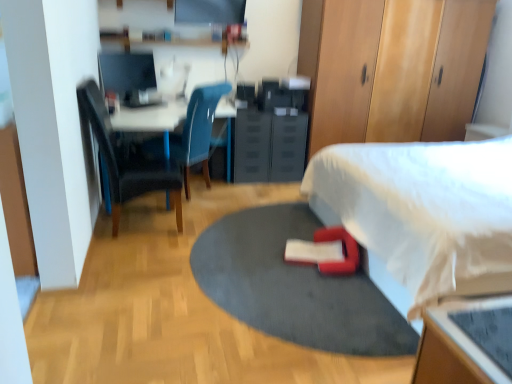
Question: Could you tell me if white glossy desk at upper left is turned towards wooden dresser at upper right, the 2th dresser viewed from the left?

Choices:
 (A) no
 (B) yes

Answer: (B)

Question: Is white glossy desk at upper left positioned far away from wooden dresser at upper right, the 2th dresser viewed from the left?

Choices:
 (A) no
 (B) yes

Answer: (B)

Question: Is white glossy desk at upper left oriented away from wooden dresser at upper right, placed as the 1th dresser when sorted from right to left?

Choices:
 (A) no
 (B) yes

Answer: (A)

Question: Considering the relative sizes of white glossy desk at upper left and wooden dresser at upper right, the 2th dresser viewed from the left, in the image provided, is white glossy desk at upper left wider than wooden dresser at upper right, the 2th dresser viewed from the left,?

Choices:
 (A) yes
 (B) no

Answer: (A)

Question: Is the depth of white glossy desk at upper left greater than that of wooden dresser at upper right, the 2th dresser viewed from the left?

Choices:
 (A) no
 (B) yes

Answer: (A)

Question: Considering the relative positions of white glossy desk at upper left and wooden dresser at upper right, placed as the 1th dresser when sorted from right to left, in the image provided, is white glossy desk at upper left to the right of wooden dresser at upper right, placed as the 1th dresser when sorted from right to left, from the viewer's perspective?

Choices:
 (A) no
 (B) yes

Answer: (A)

Question: Is white fabric bed at lower right behind wooden dresser at upper right, the 2th dresser viewed from the left?

Choices:
 (A) no
 (B) yes

Answer: (A)

Question: Is white fabric bed at lower right wider than wooden dresser at upper right, the 2th dresser viewed from the left?

Choices:
 (A) no
 (B) yes

Answer: (B)

Question: Can you confirm if white fabric bed at lower right is positioned to the left of wooden dresser at upper right, the 2th dresser viewed from the left?

Choices:
 (A) no
 (B) yes

Answer: (A)

Question: Can you confirm if white fabric bed at lower right is smaller than wooden dresser at upper right, the 2th dresser viewed from the left?

Choices:
 (A) yes
 (B) no

Answer: (B)

Question: Is white fabric bed at lower right oriented away from wooden dresser at upper right, the 2th dresser viewed from the left?

Choices:
 (A) yes
 (B) no

Answer: (B)

Question: Is white fabric bed at lower right thinner than wooden dresser at upper right, placed as the 1th dresser when sorted from right to left?

Choices:
 (A) no
 (B) yes

Answer: (A)

Question: Does matte black monitor at upper left have a greater width compared to red rubber yoga mat at center?

Choices:
 (A) yes
 (B) no

Answer: (B)